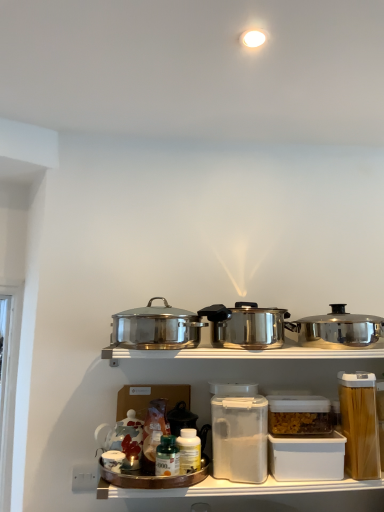
I want to click on free space to the left of white plastic bottle at center, the 1th bottle in the right-to-left sequence, so 128,473.